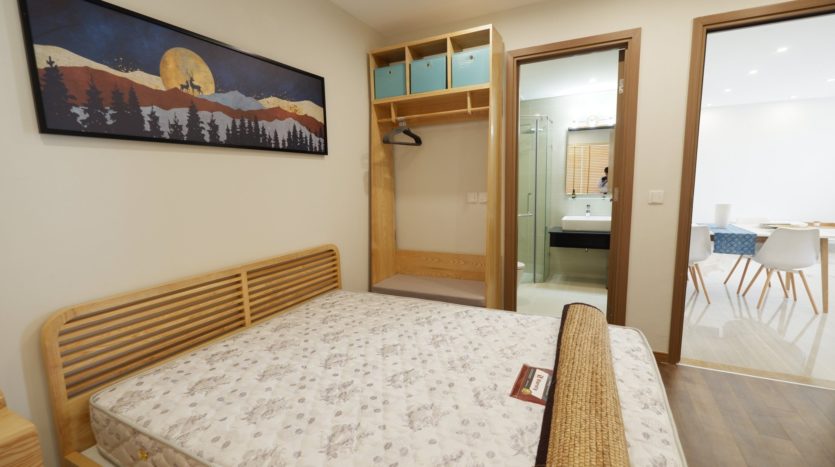
Image resolution: width=835 pixels, height=467 pixels. I want to click on blue storage cubes, so click(x=393, y=88), click(x=422, y=83), click(x=463, y=71).